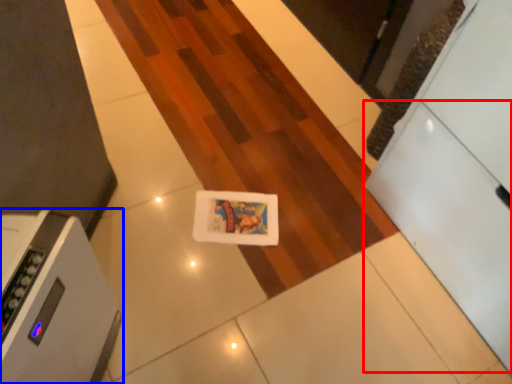
Question: Which object is closer to the camera taking this photo, drawer (highlighted by a red box) or home appliance (highlighted by a blue box)?

Choices:
 (A) drawer
 (B) home appliance

Answer: (A)